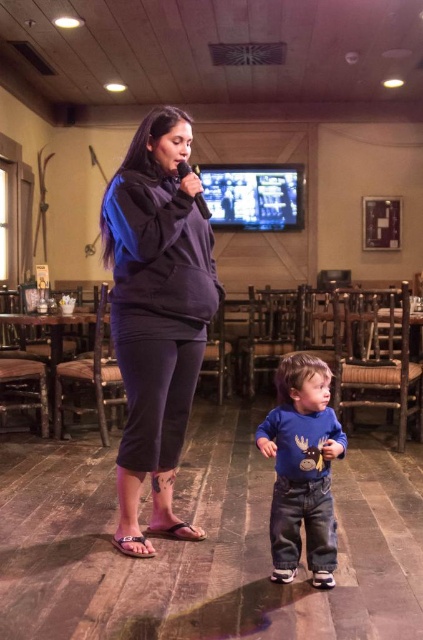
Does dark gray fleece at center have a larger size compared to blue cotton shirt at lower center?

Yes, dark gray fleece at center is bigger than blue cotton shirt at lower center.

Does dark gray fleece at center have a greater height compared to blue cotton shirt at lower center?

Correct, dark gray fleece at center is much taller as blue cotton shirt at lower center.

The image size is (423, 640). Identify the location of dark gray fleece at center. (156, 314).

Who is positioned more to the left, dark gray fleece at center or black matte microphone at upper center?

dark gray fleece at center is more to the left.

This screenshot has height=640, width=423. What do you see at coordinates (156, 314) in the screenshot? I see `dark gray fleece at center` at bounding box center [156, 314].

Locate an element on the screen. dark gray fleece at center is located at coordinates (156, 314).

Between point (291, 538) and point (205, 202), which one is positioned behind?

Point (205, 202)

Which is behind, point (296, 536) or point (180, 168)?

Point (180, 168)

I want to click on blue cotton shirt at lower center, so click(x=302, y=468).